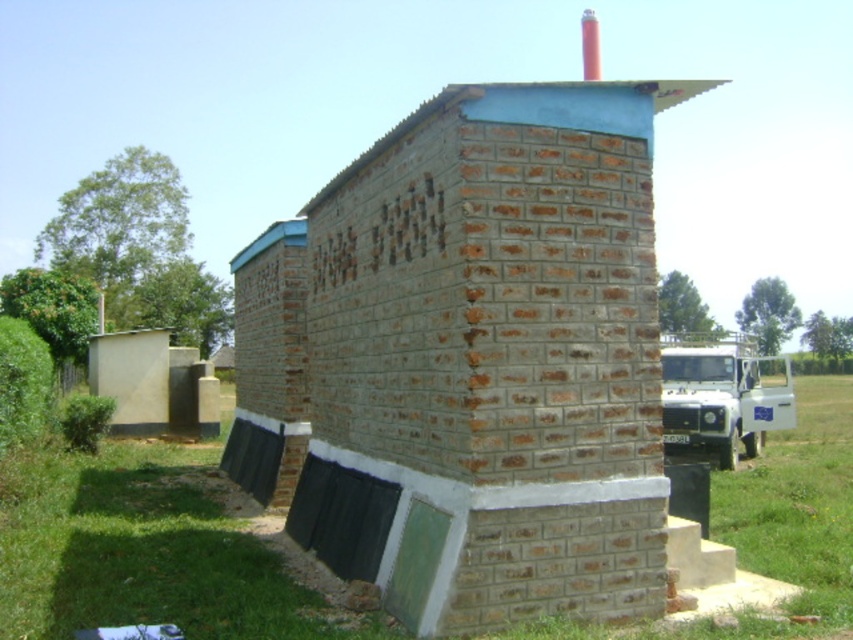
You are standing in front of the brick structure and want to locate two specific points marked on the building. The first point is at coordinate point(503, 340) and the second point is at coordinate point(595, 22). Which point is closer to you?

Point(503, 340) is in front of point(595, 22), so the first point is closer to you.

You are standing in front of the brown brick hut at center and want to locate the smooth red chimney at upper center. In which direction should you turn your head to see it?

The smooth red chimney at upper center is to the right of the brown brick hut at center, so you should turn your head to the right to see it.

In the scene shown: You are standing in front of the brick structure. There is a point at coordinates (482, 358). What does this point correspond to?

The point at coordinates (482, 358) corresponds to the brown brick hut at center.